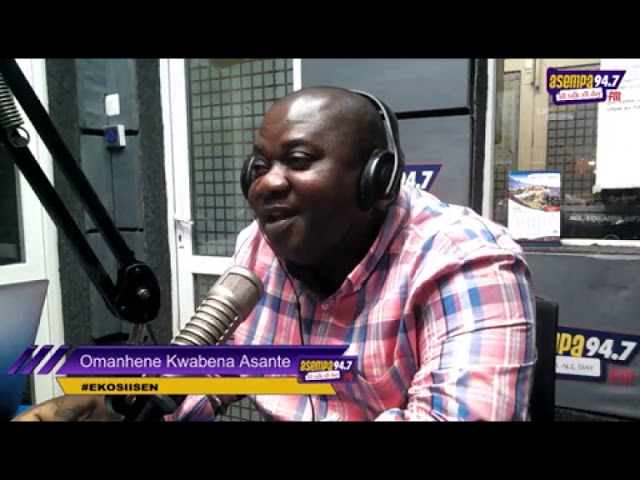
Find the location of a particular element. The height and width of the screenshot is (480, 640). calendar is located at coordinates (538, 198).